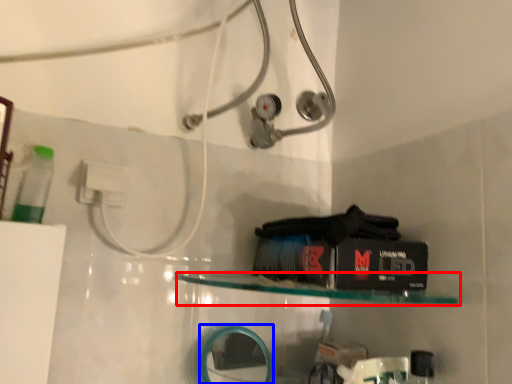
Question: Which object appears farthest to the camera in this image, shelf (highlighted by a red box) or mirror (highlighted by a blue box)?

Choices:
 (A) shelf
 (B) mirror

Answer: (B)